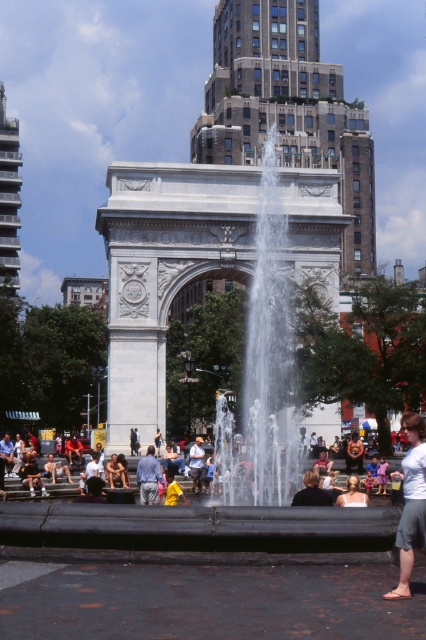
You are a photographer standing in front of the brown stone arch at center and the light blue denim jacket at center. You want to capture both subjects in a single frame. Which object should you focus on to ensure both are visible without zooming in or out?

The brown stone arch at center is wider than the light blue denim jacket at center. To capture both in a single frame without zooming, focus on the brown stone arch at center as it is wider and will allow the light blue denim jacket at center to fit within the same shot.

You are a tourist standing in front of the brown stone arch at center and the light blue shirt at center. Which object is higher from the ground?

The brown stone arch at center is positioned over the light blue shirt at center, so the brown stone arch at center is higher from the ground.

You are a tourist standing at the base of the smooth concrete tower at left and want to reach the light blue denim jacket at center. The path between them is straight. If you walk at a speed of 1.5 meters per second, how many seconds will it take you to reach the jacket?

The distance between the smooth concrete tower at left and the light blue denim jacket at center is 43.64 meters. At a walking speed of 1.5 meters per second, it would take approximately 29.09 seconds to reach the jacket. Since we typically round to the nearest whole number, it would take about 29 seconds.